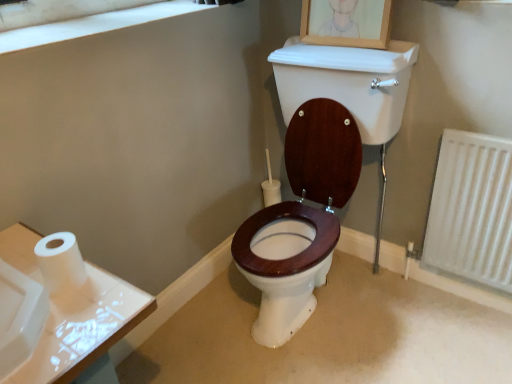
Question: From the image's perspective, is white textured radiator at lower right located beneath white matte window frame at upper left?

Choices:
 (A) yes
 (B) no

Answer: (A)

Question: Are white textured radiator at lower right and white matte window frame at upper left far apart?

Choices:
 (A) yes
 (B) no

Answer: (A)

Question: Is white textured radiator at lower right not inside white matte window frame at upper left?

Choices:
 (A) yes
 (B) no

Answer: (A)

Question: Considering the relative sizes of white textured radiator at lower right and white matte window frame at upper left in the image provided, is white textured radiator at lower right thinner than white matte window frame at upper left?

Choices:
 (A) no
 (B) yes

Answer: (B)

Question: From a real-world perspective, is white textured radiator at lower right on top of white matte window frame at upper left?

Choices:
 (A) no
 (B) yes

Answer: (A)

Question: Relative to white matte toilet paper at left, is white textured radiator at lower right in front or behind?

Choices:
 (A) behind
 (B) front

Answer: (A)

Question: Considering the positions of white textured radiator at lower right and white matte toilet paper at left in the image, is white textured radiator at lower right bigger or smaller than white matte toilet paper at left?

Choices:
 (A) big
 (B) small

Answer: (A)

Question: Is white textured radiator at lower right to the left or to the right of white matte toilet paper at left in the image?

Choices:
 (A) right
 (B) left

Answer: (A)

Question: From a real-world perspective, is white textured radiator at lower right above or below white matte toilet paper at left?

Choices:
 (A) below
 (B) above

Answer: (A)

Question: Considering their positions, is white matte window frame at upper left located in front of or behind white textured radiator at lower right?

Choices:
 (A) front
 (B) behind

Answer: (A)

Question: Visually, is white matte window frame at upper left positioned to the left or to the right of white textured radiator at lower right?

Choices:
 (A) right
 (B) left

Answer: (B)

Question: Is white matte window frame at upper left wider or thinner than white textured radiator at lower right?

Choices:
 (A) wide
 (B) thin

Answer: (A)

Question: From the image's perspective, relative to white textured radiator at lower right, is white matte window frame at upper left above or below?

Choices:
 (A) above
 (B) below

Answer: (A)

Question: Choose the correct answer: Is white matte toilet paper at left inside wooden picture frame at upper center or outside it?

Choices:
 (A) outside
 (B) inside

Answer: (A)

Question: Is white matte toilet paper at left bigger or smaller than wooden picture frame at upper center?

Choices:
 (A) small
 (B) big

Answer: (A)